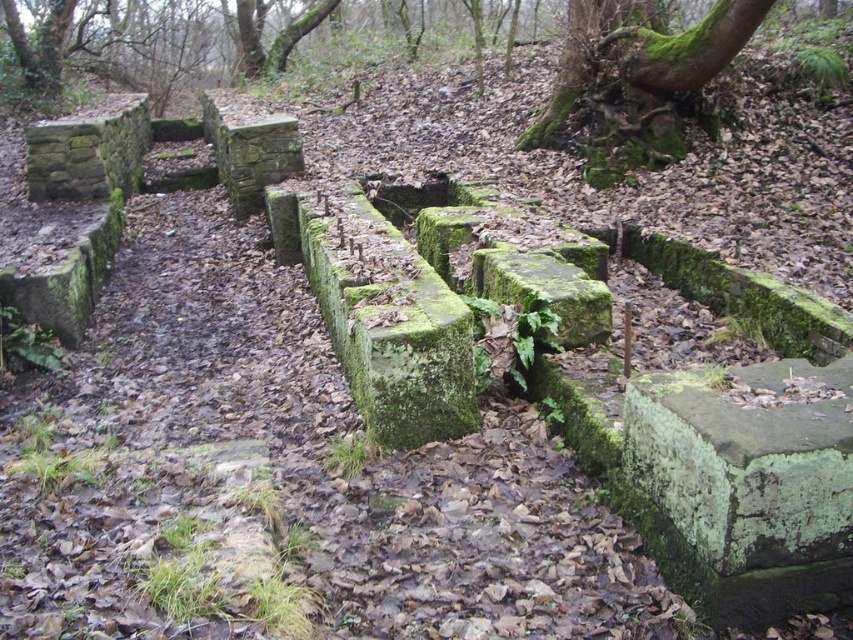
Question: Which object is positioned closest to the green mossy stone at upper left?

Choices:
 (A) green mossy stone at lower right
 (B) green mossy tree trunk at upper right
 (C) green mossy stone at center

Answer: (B)

Question: Can you confirm if green mossy stone at lower right is positioned below green mossy tree trunk at upper right?

Choices:
 (A) no
 (B) yes

Answer: (B)

Question: Can you confirm if green mossy stone at upper left is positioned to the left of green mossy stone at center?

Choices:
 (A) no
 (B) yes

Answer: (B)

Question: Estimate the real-world distances between objects in this image. Which object is closer to the green mossy tree trunk at upper right?

Choices:
 (A) green mossy stone at lower right
 (B) green mossy stone at upper left

Answer: (A)

Question: Which of the following is the farthest from the observer?

Choices:
 (A) (630, 461)
 (B) (509, 257)
 (C) (718, 26)
 (D) (115, 109)

Answer: (D)

Question: Is green mossy stone at lower right positioned in front of green mossy stone at upper left?

Choices:
 (A) no
 (B) yes

Answer: (B)